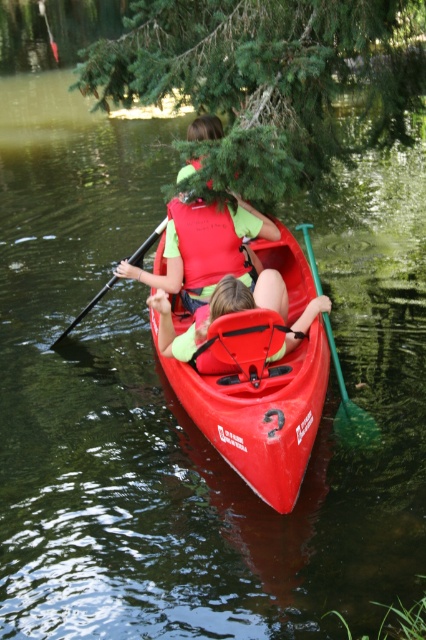
Does matte red kayak at center have a lesser height compared to matte green life vest at center?

Incorrect, matte red kayak at center's height does not fall short of matte green life vest at center's.

Who is higher up, matte red kayak at center or matte green life vest at center?

Positioned higher is matte green life vest at center.

Does point (304, 262) come closer to viewer compared to point (301, 326)?

No, it is not.

In order to click on matte red kayak at center in this screenshot , I will do `click(259, 417)`.

Does point (199, 378) come farther from viewer compared to point (201, 280)?

That is False.

Is matte red kayak at center further to the viewer compared to matte green life jacket at center?

No, matte red kayak at center is closer to the viewer.

Where is `matte red kayak at center`? This screenshot has height=640, width=426. matte red kayak at center is located at coordinates (259, 417).

Can you confirm if matte green life jacket at center is thinner than black plastic paddle at center?

Yes, matte green life jacket at center is thinner than black plastic paddle at center.

Does matte green life jacket at center appear on the right side of black plastic paddle at center?

Indeed, matte green life jacket at center is positioned on the right side of black plastic paddle at center.

Is point (210, 205) behind point (154, 230)?

No.

Image resolution: width=426 pixels, height=640 pixels. In order to click on matte green life jacket at center in this screenshot , I will do `click(209, 244)`.